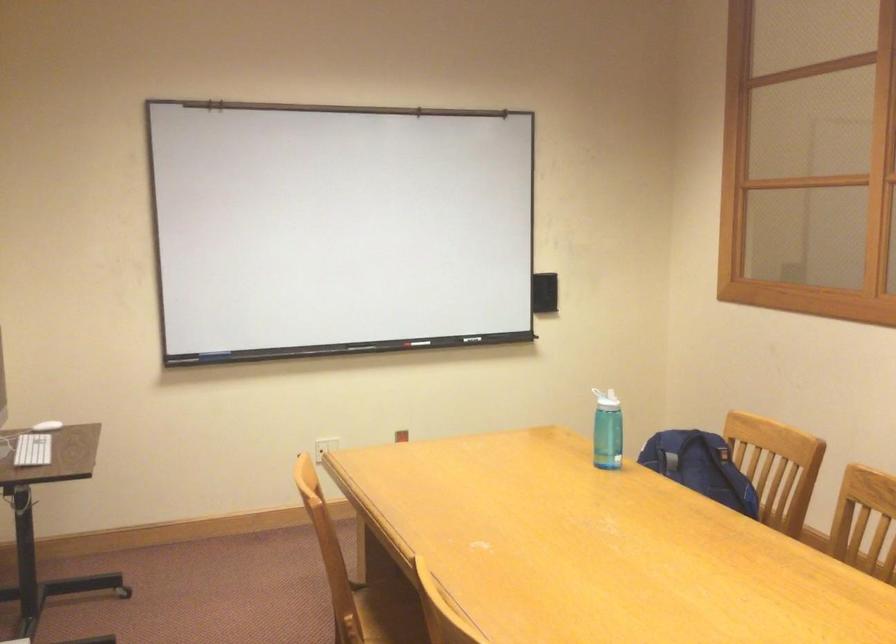
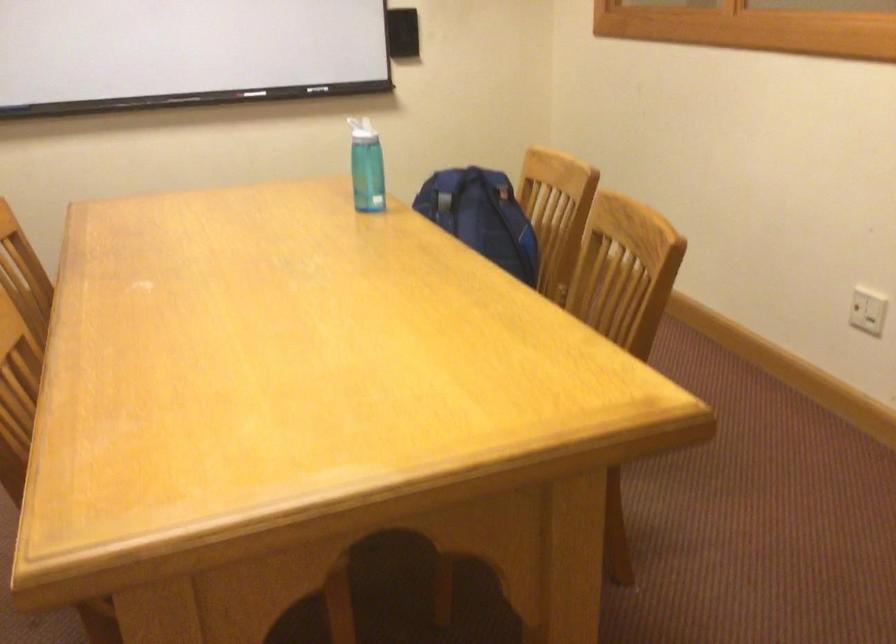
Question: Based on the continuous images, in which direction is the camera rotating? Reply with the corresponding letter.

Choices:
 (A) Left
 (B) Right
 (C) Up
 (D) Down

Answer: (D)